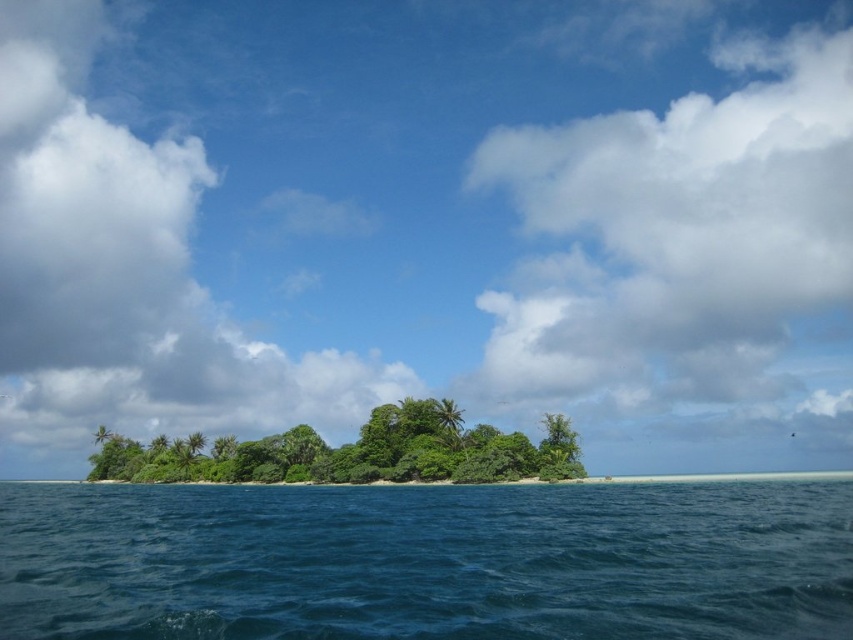
Which is more to the right, deep blue water at center or green leafy trees at center?

Positioned to the right is deep blue water at center.

Who is more distant from viewer, (471,486) or (360,458)?

Point (360,458)

Find the location of a particular element. Image resolution: width=853 pixels, height=640 pixels. deep blue water at center is located at coordinates (427, 561).